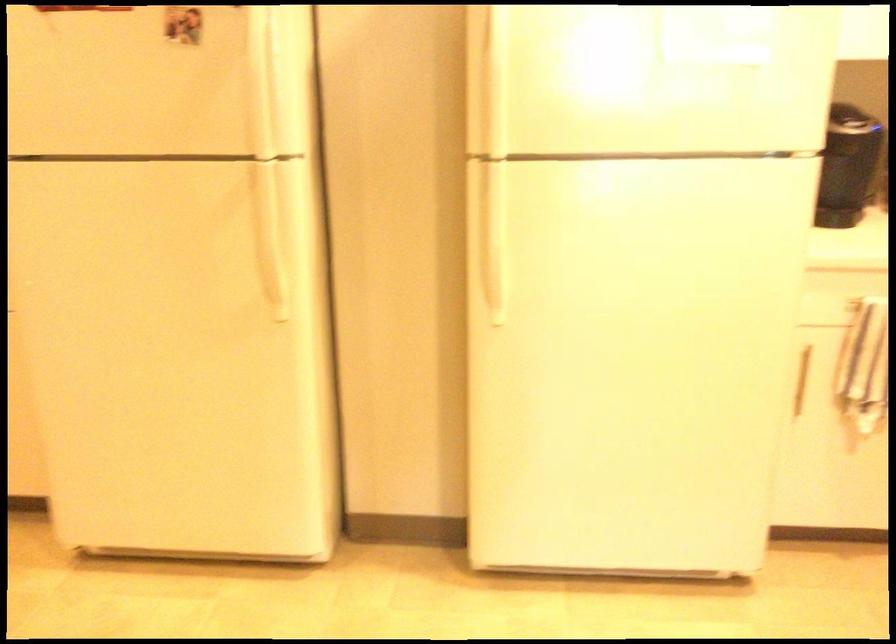
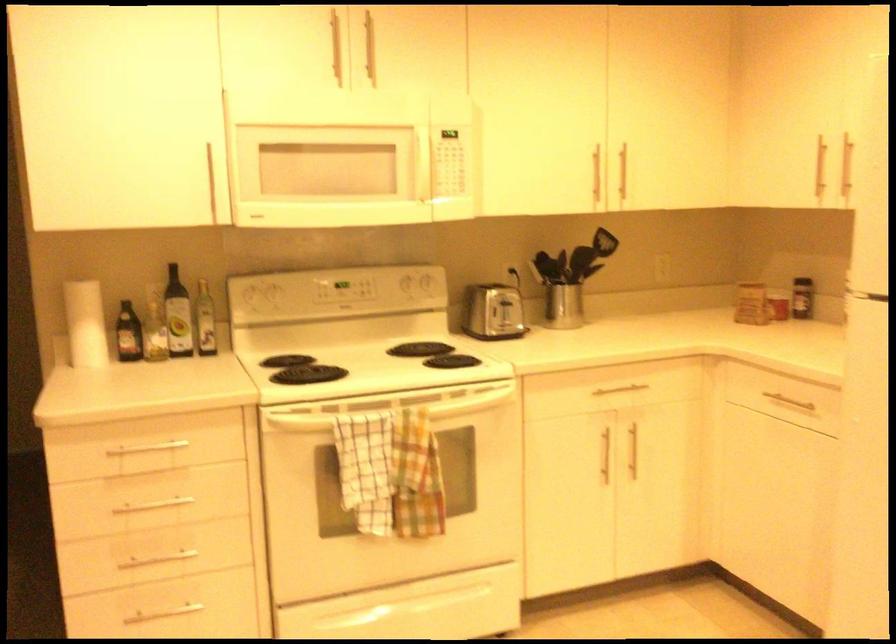
Question: The images are taken continuously from a first-person perspective. In which direction is your viewpoint rotating?

Choices:
 (A) Left
 (B) Right
 (C) Up
 (D) Down

Answer: (A)